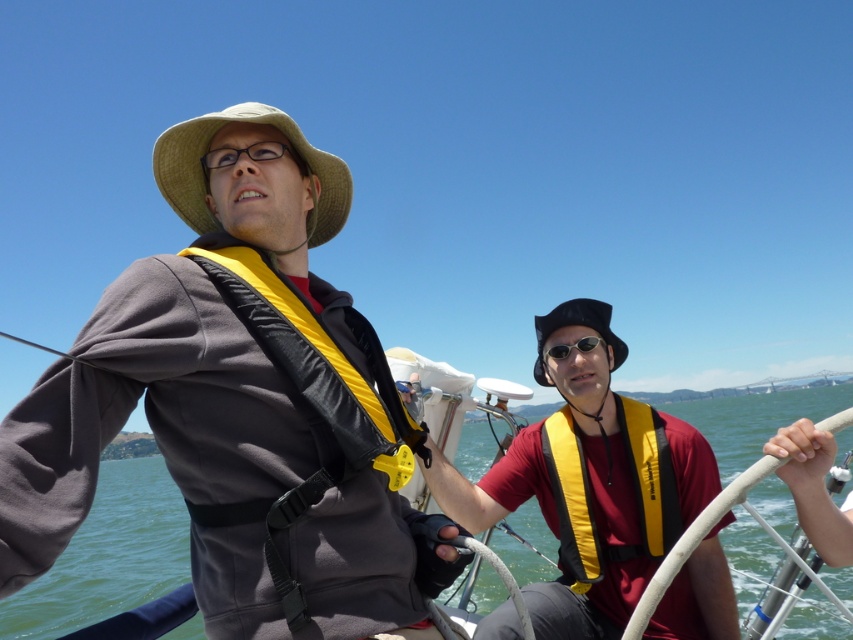
You are a safety inspector checking the boat for proper equipment placement. According to regulations, life vests must be placed within easy reach of the steering area. Given the positions of the matte yellow life vest at center and the black straw hat at center, can you confirm if the life vest is positioned appropriately?

The matte yellow life vest at center might be wider than black straw hat at center, which suggests it could occupy more space and potentially be within reach for quick access. However, without exact measurements, it is recommended to physically verify the placement against the regulation requirements.

You are a sailor trying to locate the matte yellow life vest at center on the boat. Based on the coordinates provided, can you determine its exact location?

The matte yellow life vest at center is located at coordinates point (213, 468).

You are standing on the boat and want to check the depth of the water at the point marked by coordinates point (108, 554). Which object should you look at to determine this?

The clear blue water at center located at point (108, 554) is where you should check the depth.